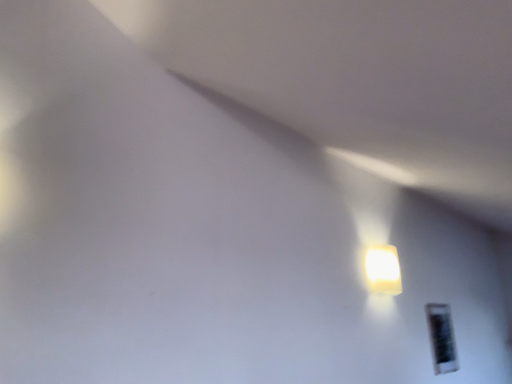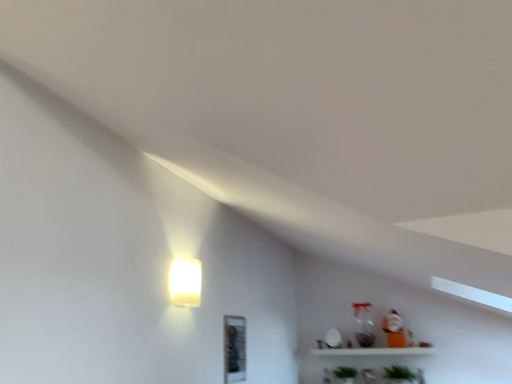
Question: Which way did the camera rotate in the video?

Choices:
 (A) rotated left
 (B) rotated right

Answer: (B)